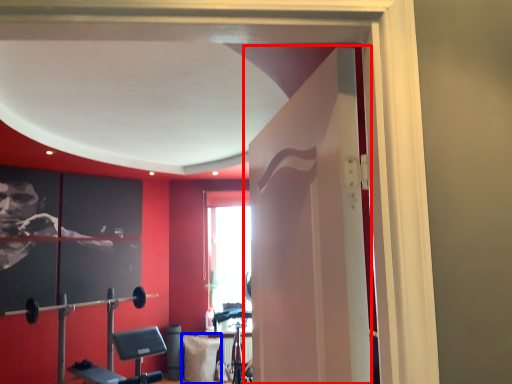
Question: Among these objects, which one is nearest to the camera, door (highlighted by a red box) or pillow (highlighted by a blue box)?

Choices:
 (A) door
 (B) pillow

Answer: (A)